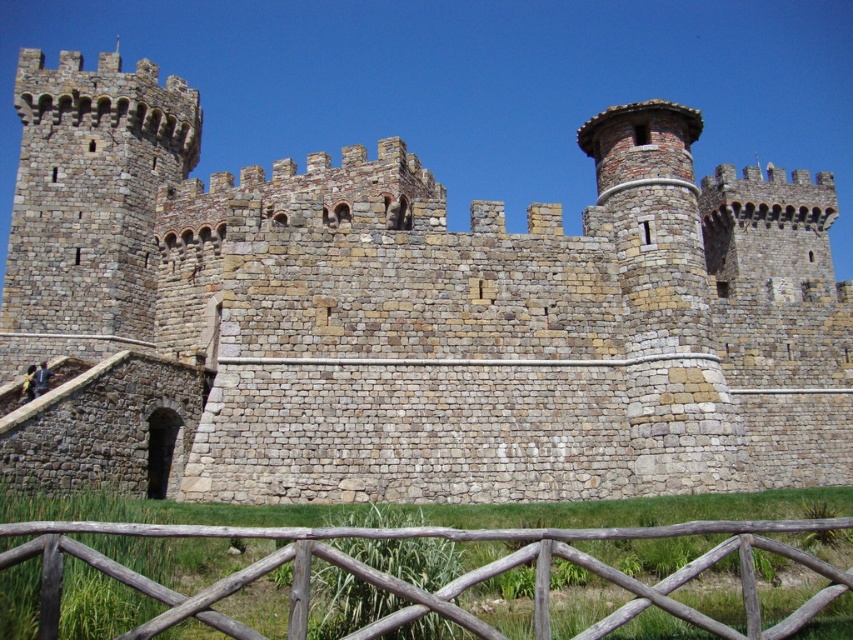
Is brown stone castle at center to the right of wooden fence at lower center from the viewer's perspective?

Yes, brown stone castle at center is to the right of wooden fence at lower center.

Who is higher up, brown stone castle at center or wooden fence at lower center?

brown stone castle at center

Is point (340, 243) less distant than point (412, 532)?

No, it is not.

This screenshot has height=640, width=853. What are the coordinates of `brown stone castle at center` in the screenshot? It's located at 425,310.